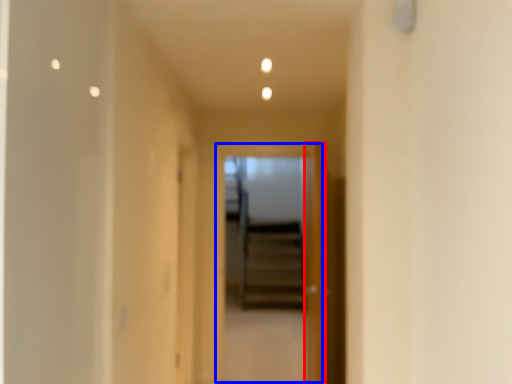
Question: Which object appears farthest to the camera in this image, door (highlighted by a red box) or screen door (highlighted by a blue box)?

Choices:
 (A) door
 (B) screen door

Answer: (B)